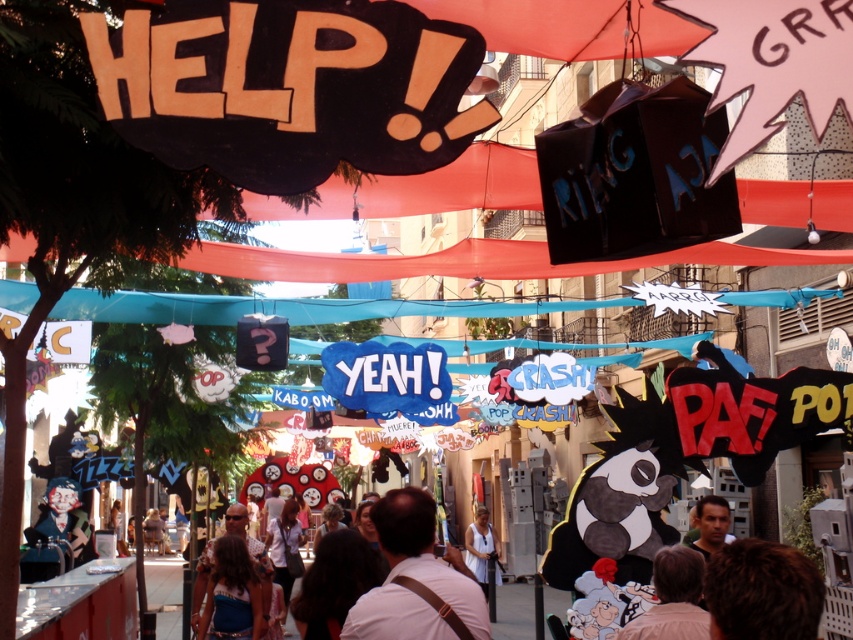
You are a photographer standing in the middle of the street. You want to take a photo that includes both the brown hair at lower right and the matte clown mask at lower left. Given that your camera can focus on objects within a 40 meter range, will both subjects be in focus?

The brown hair at lower right is 38.83 meters away from the matte clown mask at lower left. Since the distance between them is within the 40 meter range, both subjects will be in focus.

In the scene shown: Based on the scene description and the coordinates provided, where exactly is the white fabric dress at center located in the image?

The white fabric dress at center is located at the coordinates point (480, 547).

You are a photographer trying to capture both the matte clown mask at lower left and the white fabric dress at center in a single shot. Which object should you focus on first to ensure both are in focus?

The matte clown mask at lower left is closer to the viewer than the white fabric dress at center. To ensure both are in focus, you should focus on the matte clown mask at lower left first, as it is the closer object.